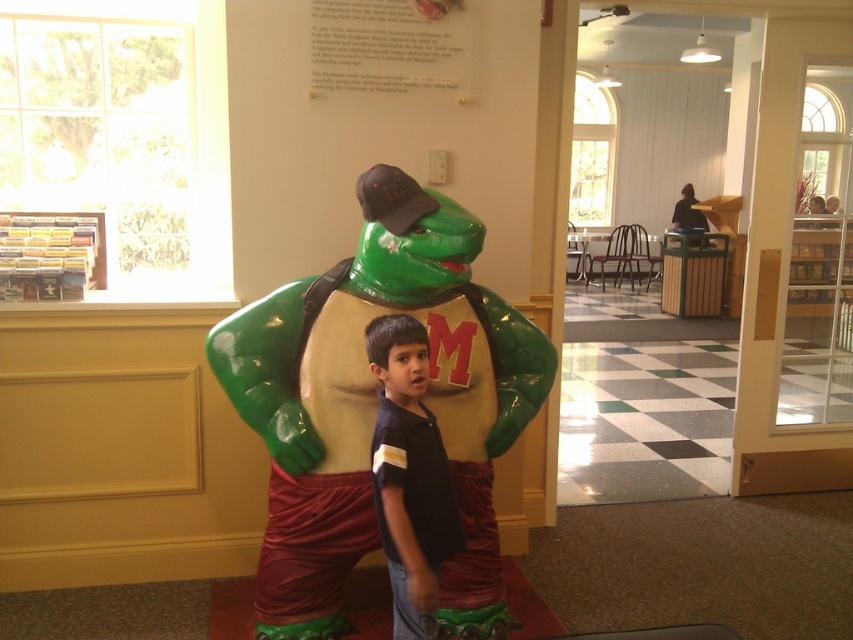
Question: Is the position of glossy plastic turtle at center less distant than that of black cotton shirt at center?

Choices:
 (A) no
 (B) yes

Answer: (A)

Question: Can you confirm if glossy plastic turtle at center is thinner than black cotton shirt at center?

Choices:
 (A) no
 (B) yes

Answer: (A)

Question: Is glossy plastic turtle at center thinner than black cotton shirt at center?

Choices:
 (A) yes
 (B) no

Answer: (B)

Question: Which point is closer to the camera?

Choices:
 (A) black cotton shirt at center
 (B) glossy plastic turtle at center

Answer: (A)

Question: Which of the following is the farthest from the observer?

Choices:
 (A) glossy plastic turtle at center
 (B) black cotton shirt at center

Answer: (A)